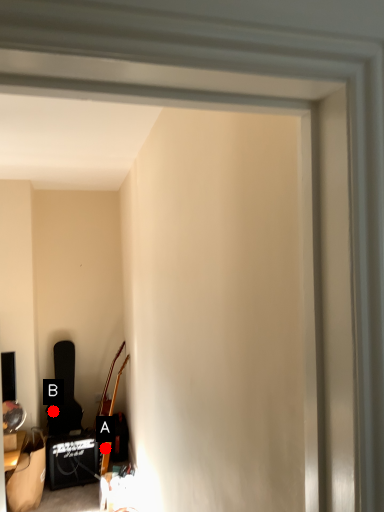
Question: Two points are circled on the image, labeled by A and B beside each circle. Which point is farther to the camera?

Choices:
 (A) A is further
 (B) B is further

Answer: (B)